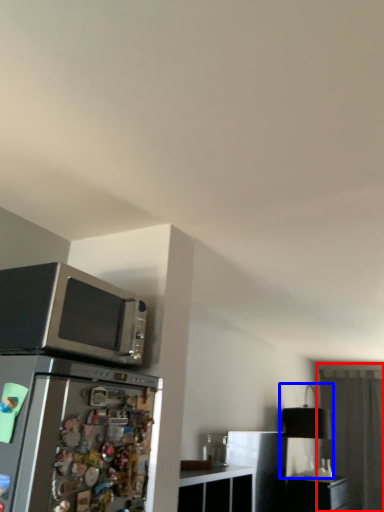
Question: Which object is further to the camera taking this photo, glass door (highlighted by a red box) or lamp (highlighted by a blue box)?

Choices:
 (A) glass door
 (B) lamp

Answer: (A)